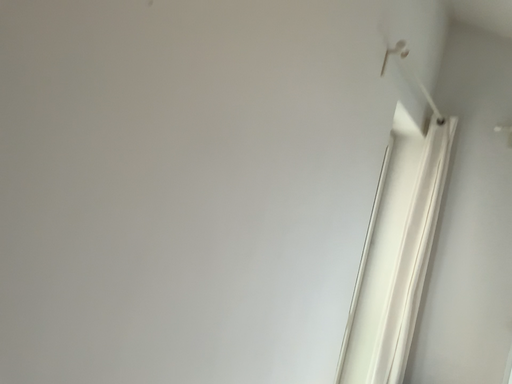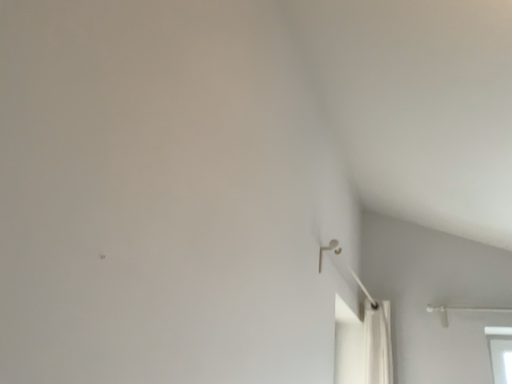
Question: How did the camera likely rotate when shooting the video?

Choices:
 (A) rotated left
 (B) rotated right

Answer: (B)